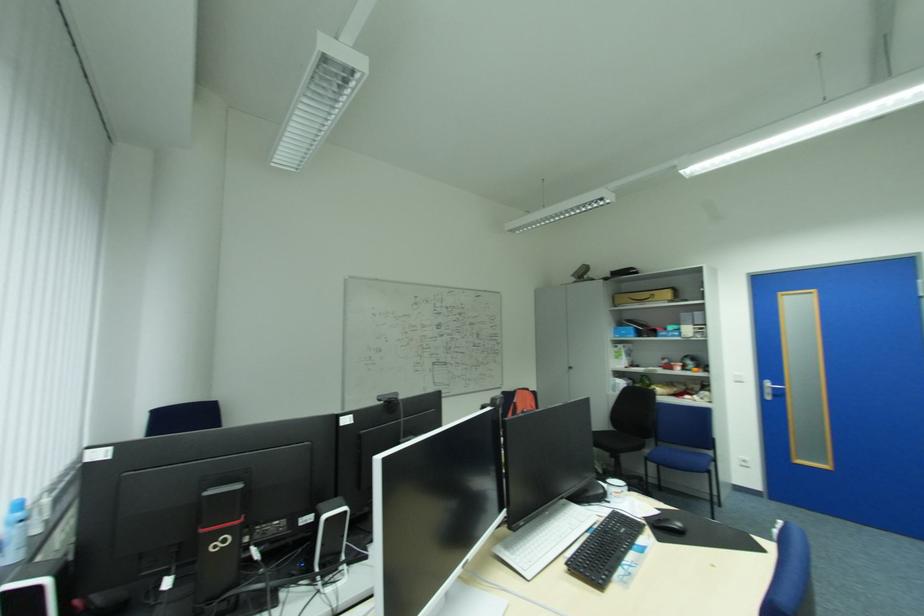
Where would you sit the chair sitting surface? Please return your answer as a coordinate pair (x, y).

(604, 438)